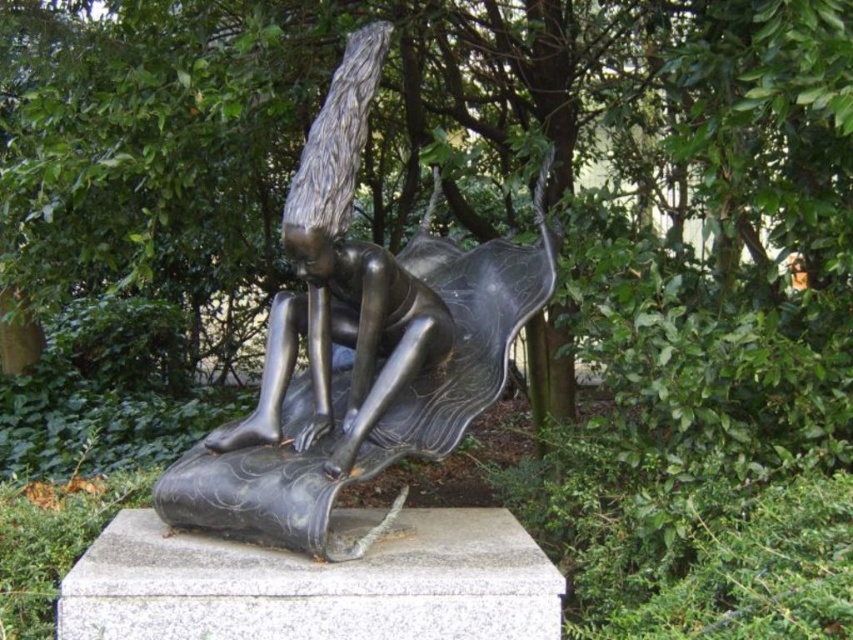
Is polished bronze statue at center positioned in front of shiny bronze figure at center?

Yes, polished bronze statue at center is closer to the viewer.

Measure the distance between polished bronze statue at center and camera.

polished bronze statue at center is 7.61 feet from camera.

Describe the element at coordinates (358, 346) in the screenshot. I see `polished bronze statue at center` at that location.

The image size is (853, 640). I want to click on polished bronze statue at center, so click(x=358, y=346).